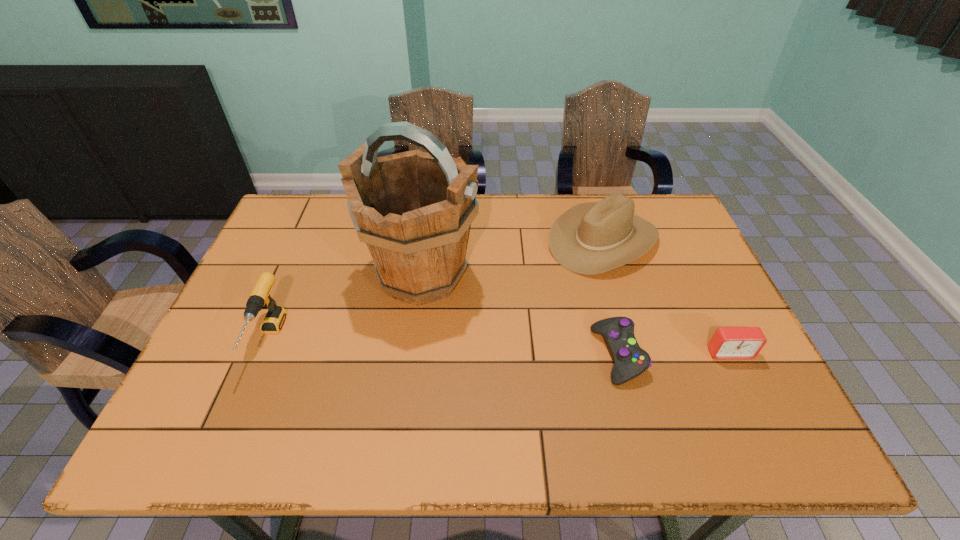
Locate an element on the screen. empty space between the second object from left to right and the leftmost object is located at coordinates (346, 307).

Identify which object is the fourth closest to the cowboy hat. Please provide its 2D coordinates. Your answer should be formatted as a tuple, i.e. [(x, y)], where the tuple contains the x and y coordinates of a point satisfying the conditions above.

[(259, 298)]

Identify which object is located as the nearest to the control. Please provide its 2D coordinates. Your answer should be formatted as a tuple, i.e. [(x, y)], where the tuple contains the x and y coordinates of a point satisfying the conditions above.

[(727, 342)]

The width and height of the screenshot is (960, 540). I want to click on free space in the image that satisfies the following two spatial constraints: 1. on the handle side of the control; 2. on the right side of the leftmost object, so click(x=262, y=355).